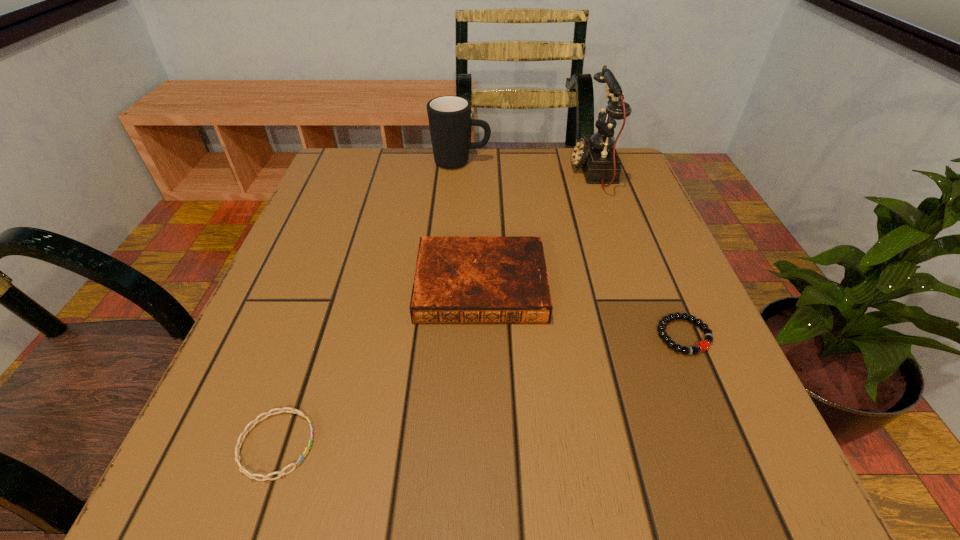
Locate an element on the screen. The width and height of the screenshot is (960, 540). free region that satisfies the following two spatial constraints: 1. on the side of the right bracelet with the handle; 2. on the right side of the mug is located at coordinates click(x=450, y=336).

This screenshot has width=960, height=540. I want to click on vacant space that satisfies the following two spatial constraints: 1. on the dial of the telephone; 2. on the back side of the farther bracelet, so click(652, 336).

Find the location of `free point that satisfies the following two spatial constraints: 1. on the side of the mug with the handle; 2. on the back side of the farther bracelet`. free point that satisfies the following two spatial constraints: 1. on the side of the mug with the handle; 2. on the back side of the farther bracelet is located at coordinates (450, 336).